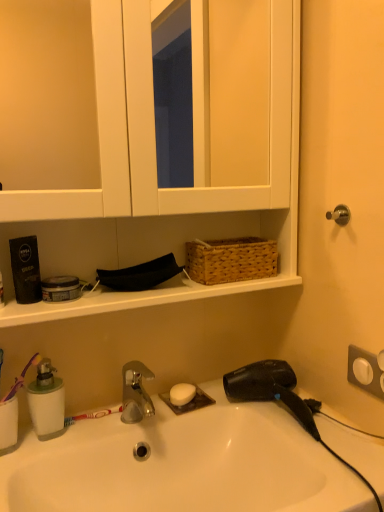
Where is `vacant space in front of white matte soap at center`? The height and width of the screenshot is (512, 384). vacant space in front of white matte soap at center is located at coordinates (169, 419).